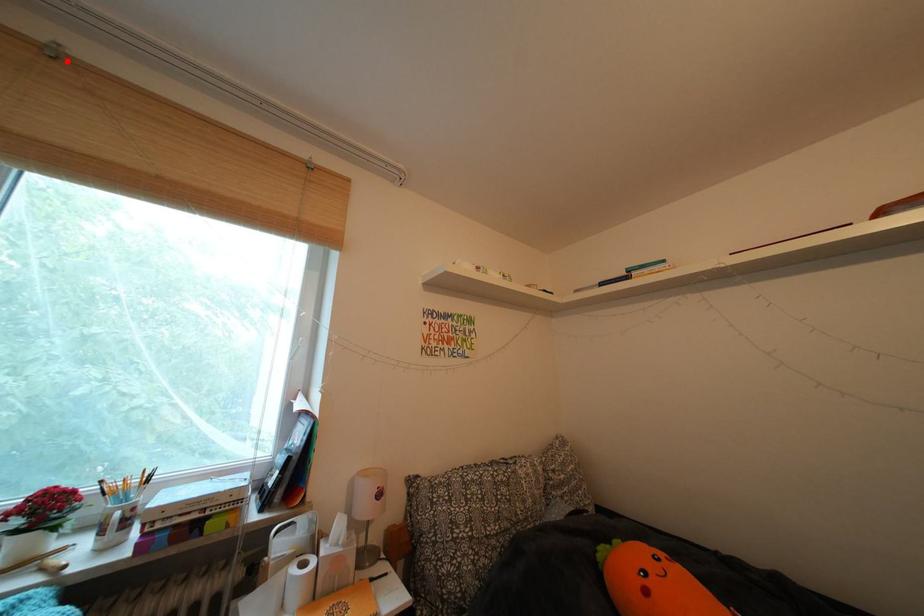
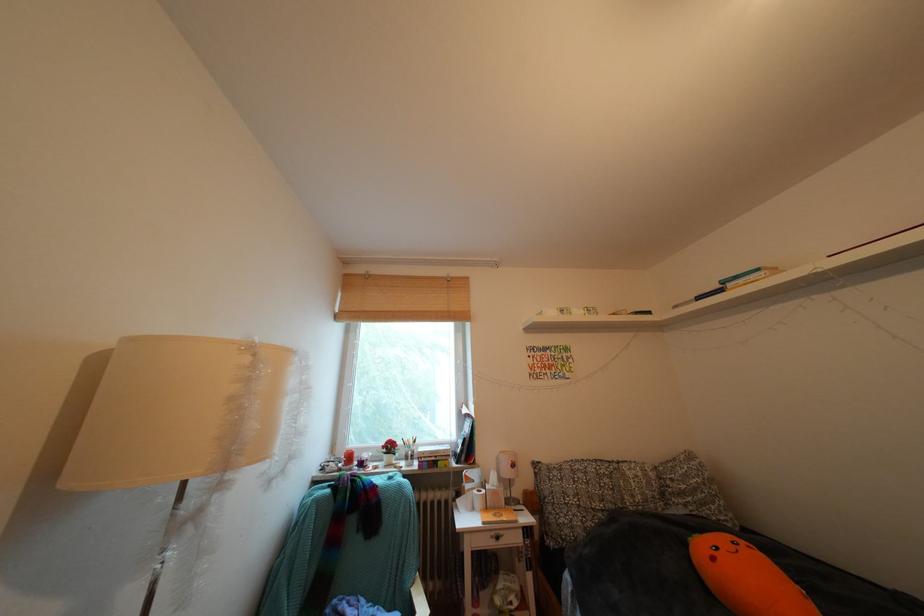
In the second image, find the point that corresponds to the highlighted location in the first image.

(379, 282)